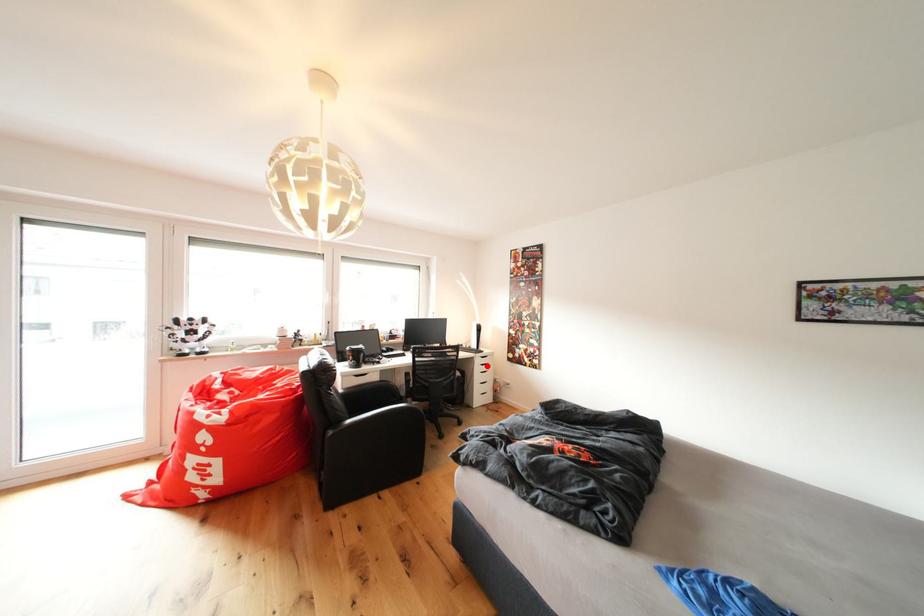
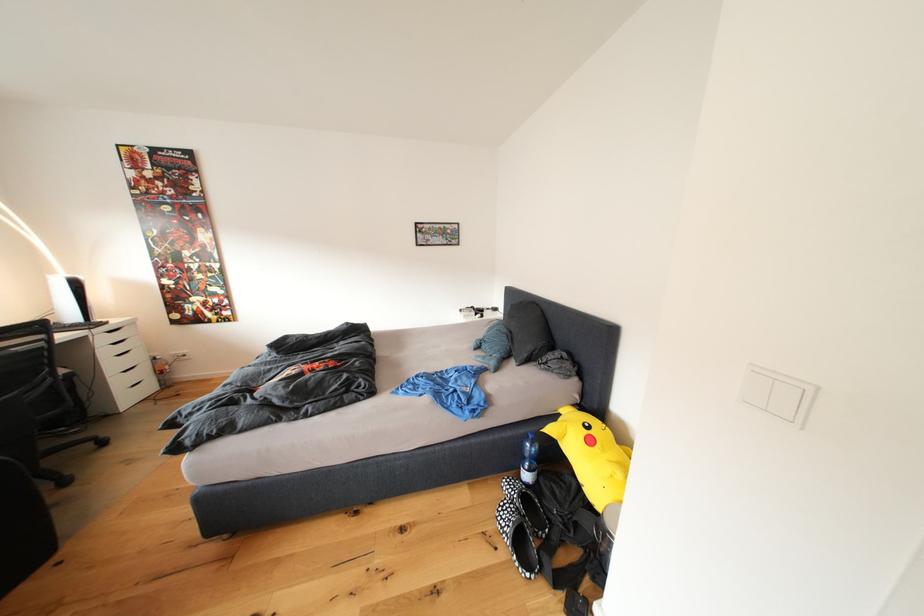
In the second image, find the point that corresponds to the highlighted location in the first image.

(111, 344)